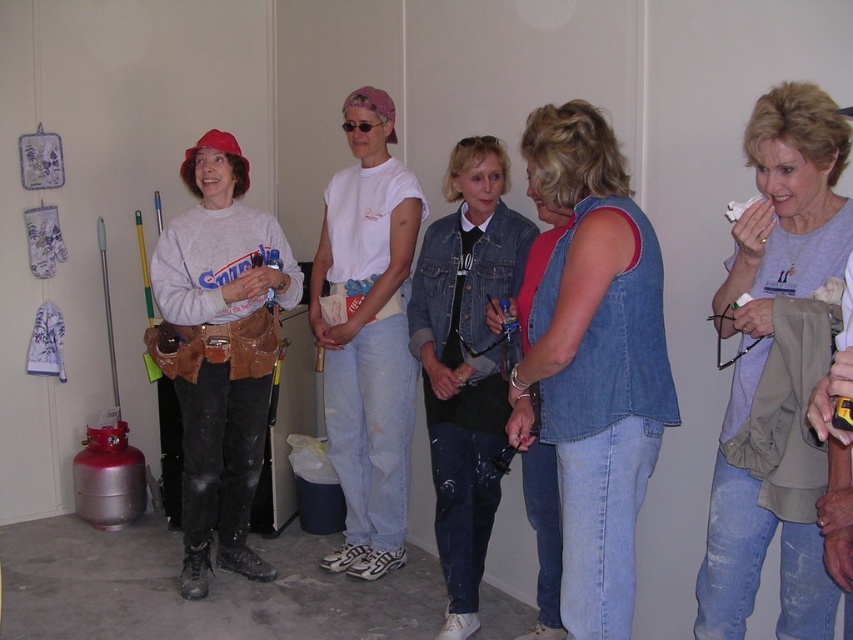
Question: Based on their relative distances, which object is nearer to the denim jacket at center?

Choices:
 (A) denim vest at center
 (B) gray matte shirt at upper right

Answer: (A)

Question: Does denim vest at center appear on the right side of matte gray sweatshirt at left?

Choices:
 (A) no
 (B) yes

Answer: (B)

Question: Which object is the farthest from the gray matte shirt at upper right?

Choices:
 (A) matte gray sweatshirt at left
 (B) denim jacket at center
 (C) denim vest at center

Answer: (A)

Question: Can you confirm if denim vest at center is smaller than denim jacket at center?

Choices:
 (A) yes
 (B) no

Answer: (A)

Question: Can you confirm if gray matte shirt at upper right is thinner than denim jacket at center?

Choices:
 (A) yes
 (B) no

Answer: (A)

Question: Which object is closer to the camera taking this photo?

Choices:
 (A) denim jacket at center
 (B) gray matte shirt at upper right
 (C) matte gray sweatshirt at left

Answer: (B)